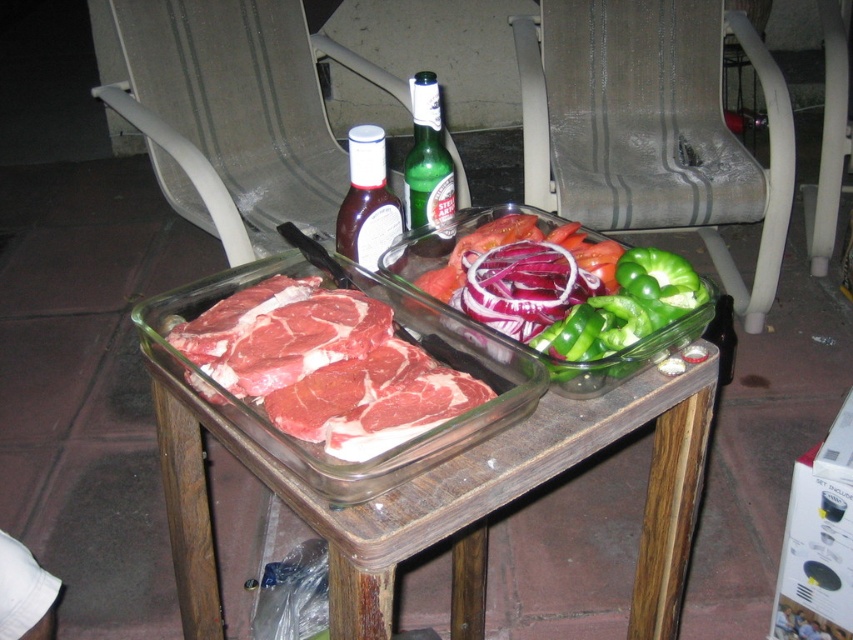
Can you confirm if white plastic chair at upper center is positioned above raw red meat at center?

Yes.

Is white plastic chair at upper center below raw red meat at center?

No.

This screenshot has width=853, height=640. Describe the element at coordinates (235, 115) in the screenshot. I see `white plastic chair at upper center` at that location.

The height and width of the screenshot is (640, 853). I want to click on white plastic chair at upper center, so click(235, 115).

Can you confirm if transparent glass tray at center is positioned above white plastic chair at upper center?

No, transparent glass tray at center is not above white plastic chair at upper center.

Describe the element at coordinates (428, 464) in the screenshot. This screenshot has width=853, height=640. I see `transparent glass tray at center` at that location.

Is point (415, 467) positioned before point (270, 188)?

Yes, it is.

Locate an element on the screen. The width and height of the screenshot is (853, 640). transparent glass tray at center is located at coordinates (x=428, y=464).

Who is positioned more to the right, green glossy bell pepper at center or green glass bottle at center?

green glossy bell pepper at center

How distant is green glossy bell pepper at center from green glass bottle at center?

green glossy bell pepper at center is 7.10 inches from green glass bottle at center.

Does point (418, 269) come closer to viewer compared to point (418, 168)?

That is False.

The image size is (853, 640). I want to click on green glossy bell pepper at center, so click(x=630, y=355).